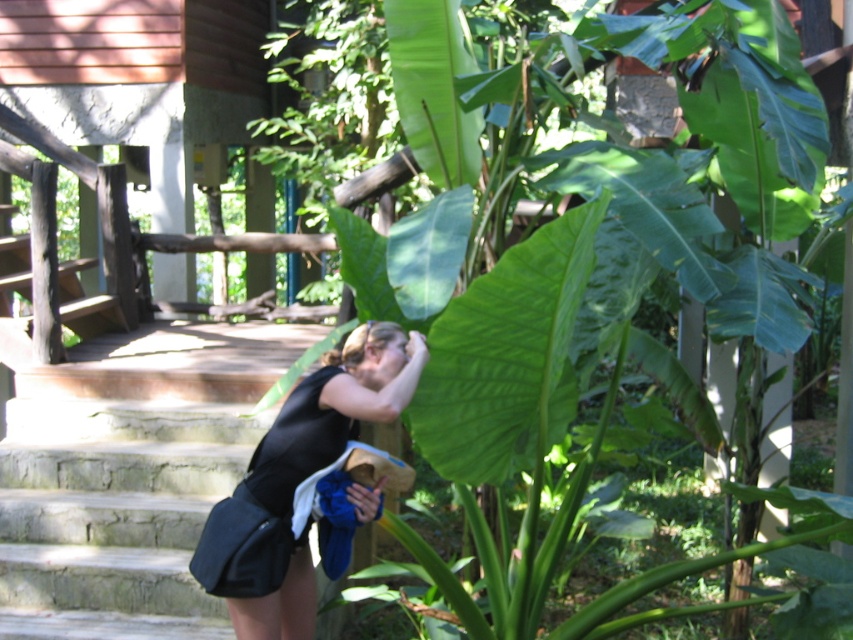
Is green leafy plant at center to the left of black matte skirt at lower center from the viewer's perspective?

No, green leafy plant at center is not to the left of black matte skirt at lower center.

Between green leafy plant at center and black matte skirt at lower center, which one has more height?

green leafy plant at center

The image size is (853, 640). I want to click on green leafy plant at center, so click(576, 256).

Between stone stairs at lower left and black matte skirt at lower center, which one is positioned higher?

black matte skirt at lower center is higher up.

Does stone stairs at lower left appear under black matte skirt at lower center?

Yes, stone stairs at lower left is below black matte skirt at lower center.

Locate an element on the screen. The image size is (853, 640). stone stairs at lower left is located at coordinates (112, 515).

Can you confirm if green leafy plant at center is smaller than stone stairs at lower left?

No.

Where is `green leafy plant at center`? The image size is (853, 640). green leafy plant at center is located at coordinates (576, 256).

You are a GUI agent. You are given a task and a screenshot of the screen. Output one action in this format:
    pyautogui.click(x=<x>, y=<y>)
    Task: Click on the green leafy plant at center
    The height and width of the screenshot is (640, 853).
    Given the screenshot: What is the action you would take?
    point(576,256)